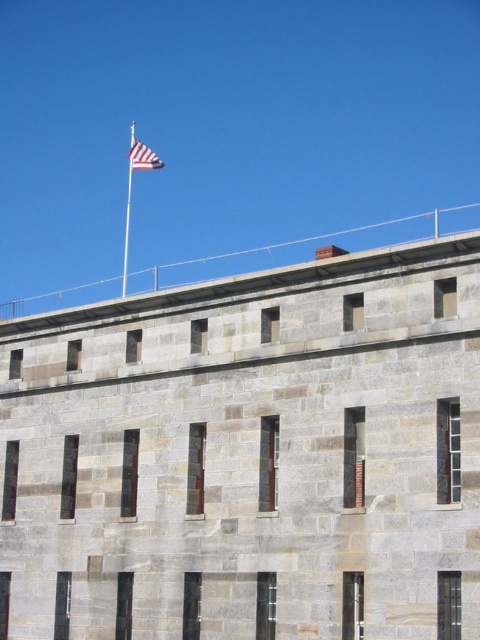
You are a photographer planning to capture the historic stone building with its flagpole and flag. Based on the scene description, which object, the polished metal flag pole at upper center or the striped fabric flag at upper center, appears narrower in your photo?

The polished metal flag pole at upper center appears narrower in the photo compared to the striped fabric flag at upper center, as it has a lesser width according to the description.

You are a visitor standing in front of the historic stone wall. You notice the polished metal flag pole at upper center and the striped fabric flag at upper center. Which object is closer to you?

The polished metal flag pole at upper center is closer to you because the striped fabric flag at upper center is behind it.

You are standing in front of the historic fortification and want to place a new decorative banner. The banner requires a pole that is positioned exactly at the center of the wall. Is the polished metal flag pole at upper center suitable for this purpose?

The polished metal flag pole at upper center is located at point (128,209), which is slightly off the exact center of the wall. Therefore, it is not positioned exactly at the center, so the banner requiring a centrally located pole cannot be placed there.